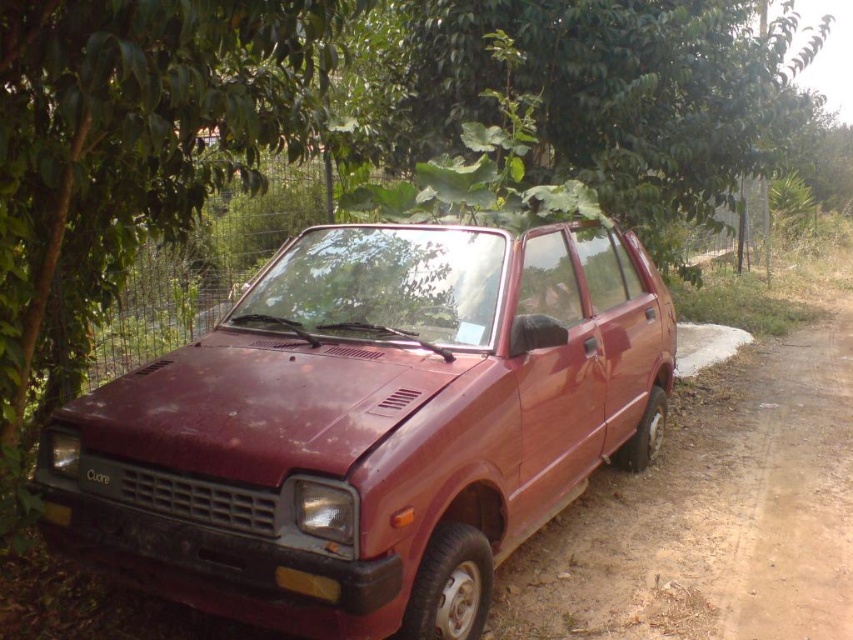
Question: Is brown dirt track at lower right in front of black matte license plate at center?

Choices:
 (A) yes
 (B) no

Answer: (B)

Question: Among these objects, which one is nearest to the camera?

Choices:
 (A) dull red car at center
 (B) yellow matte license plate at front
 (C) black matte license plate at center
 (D) green leafy tree at upper center

Answer: (A)

Question: Among these points, which one is farthest from the camera?

Choices:
 (A) (277, 628)
 (B) (666, 577)
 (C) (769, 104)
 (D) (99, 481)

Answer: (C)

Question: Is brown dirt track at lower right further to the viewer compared to black matte license plate at center?

Choices:
 (A) yes
 (B) no

Answer: (A)

Question: Based on their relative distances, which object is nearer to the dull red car at center?

Choices:
 (A) black matte license plate at center
 (B) green leafy tree at upper center
 (C) brown dirt track at lower right
 (D) yellow matte license plate at front

Answer: (A)

Question: Does brown dirt track at lower right have a greater width compared to black matte license plate at center?

Choices:
 (A) yes
 (B) no

Answer: (A)